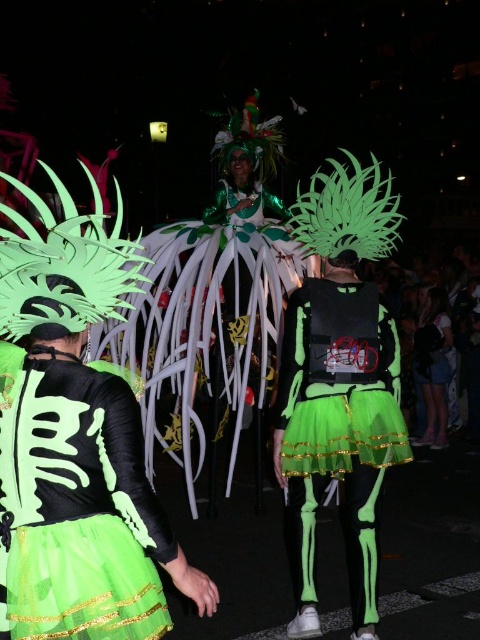
You are at the center of the parade scene. There is a neon green fabric skeleton at center. Where exactly is the neon green fabric skeleton positioned in terms of coordinates?

The neon green fabric skeleton at center is located at point (336,429).

You are a photographer trying to capture a photo of the neon green fabric skeleton at center and the green fabric costume at center. Which one should you focus on if you want to include both in the frame without moving the camera?

The neon green fabric skeleton at center is positioned on the left side of the green fabric costume at center, so focusing on the center between them would allow both to be in the frame.

You are a photographer at the event and want to capture a photo that includes both the neon green mesh dress at center and the neon green fabric skeleton at center. Which object should you focus on first if you want the one closer to the camera to be in sharp focus?

The neon green mesh dress at center is located above the neon green fabric skeleton at center, so focusing on the neon green mesh dress at center first would ensure it is in sharp focus as it is closer to the camera.